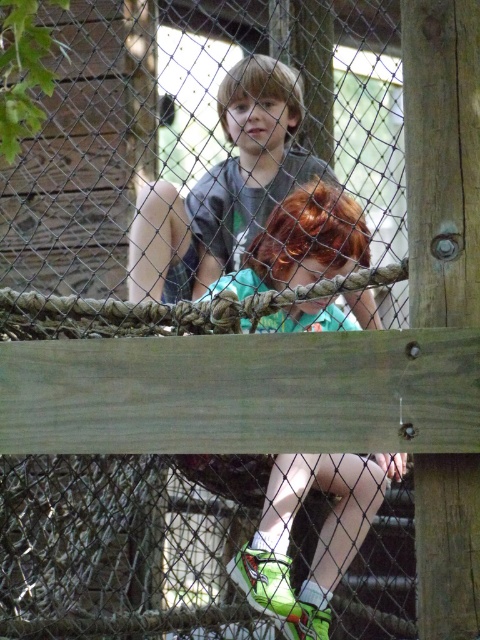
Is green fabric shirt at center to the left of matte gray shirt at center from the viewer's perspective?

No, green fabric shirt at center is not to the left of matte gray shirt at center.

This screenshot has width=480, height=640. What do you see at coordinates (317, 540) in the screenshot? I see `green fabric shirt at center` at bounding box center [317, 540].

Which is in front, point (356, 260) or point (251, 102)?

Positioned in front is point (356, 260).

This screenshot has height=640, width=480. Find the location of `green fabric shirt at center`. green fabric shirt at center is located at coordinates click(317, 540).